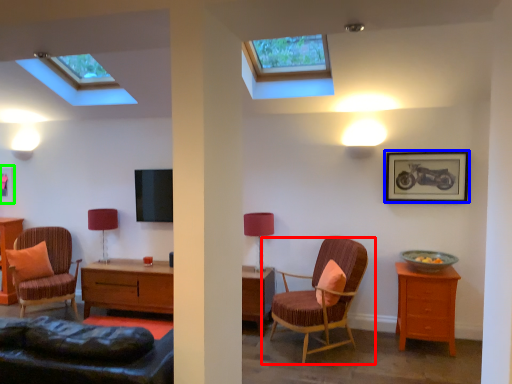
Question: Considering the real-world distances, which object is farthest from chair (highlighted by a red box)? picture frame (highlighted by a blue box) or picture frame (highlighted by a green box)?

Choices:
 (A) picture frame
 (B) picture frame

Answer: (B)